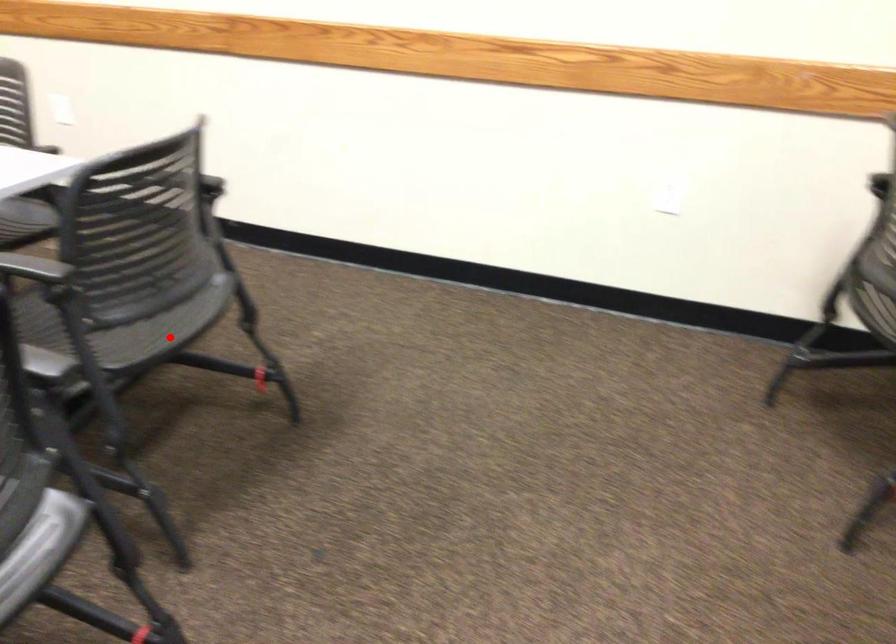
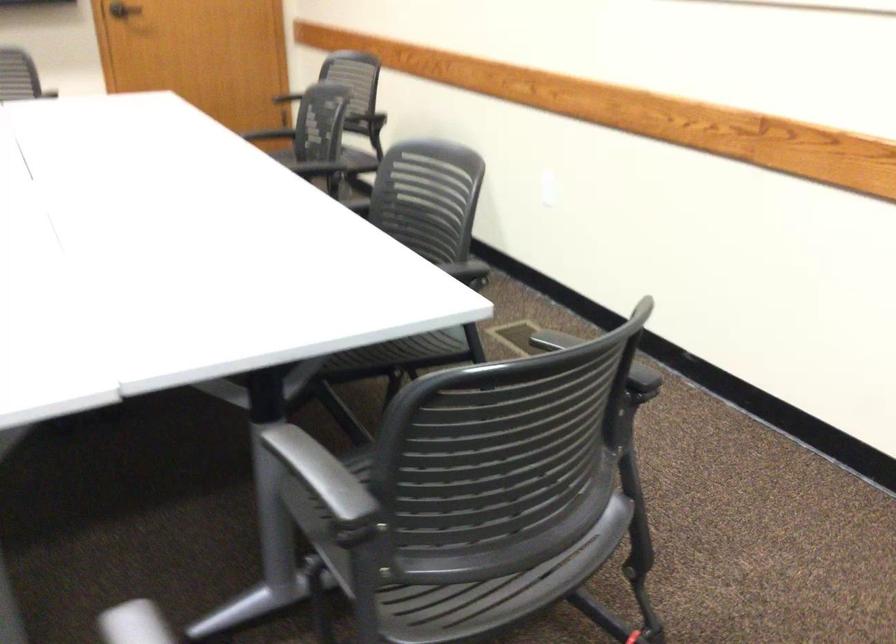
Question: I am providing you with two images of the same scene from different viewpoints. A red point is marked on the first image. Can you still see the location of the red point in image 2?

Choices:
 (A) Yes
 (B) No

Answer: (A)